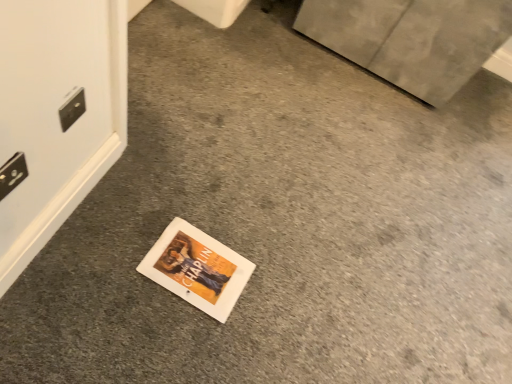
Question: Does white plastic electric outlet at upper left, positioned as the 1th electric outlet in right-to-left order, appear on the right side of black plastic electric outlet at lower left, positioned as the 2th electric outlet in top-to-bottom order?

Choices:
 (A) yes
 (B) no

Answer: (A)

Question: From the image's perspective, is white plastic electric outlet at upper left, marked as the 1th electric outlet in a back-to-front arrangement, over black plastic electric outlet at lower left, the 2th electric outlet when ordered from back to front?

Choices:
 (A) yes
 (B) no

Answer: (A)

Question: Can black plastic electric outlet at lower left, which is the second electric outlet from right to left, be found inside white plastic electric outlet at upper left, acting as the 2th electric outlet starting from the left?

Choices:
 (A) no
 (B) yes

Answer: (A)

Question: From a real-world perspective, is white plastic electric outlet at upper left, the second electric outlet when ordered from front to back, physically below black plastic electric outlet at lower left, the 1th electric outlet in the front-to-back sequence?

Choices:
 (A) yes
 (B) no

Answer: (B)

Question: Is white plastic electric outlet at upper left, which ranks as the second electric outlet in bottom-to-top order, positioned with its back to black plastic electric outlet at lower left, which is the second electric outlet from right to left?

Choices:
 (A) yes
 (B) no

Answer: (B)

Question: Does white plastic electric outlet at upper left, which ranks as the second electric outlet in bottom-to-top order, touch black plastic electric outlet at lower left, the 1th electric outlet in the front-to-back sequence?

Choices:
 (A) no
 (B) yes

Answer: (A)

Question: Does black plastic electric outlet at lower left, which is the second electric outlet from right to left, appear on the right side of white plastic electric outlet at upper left, positioned as the 1th electric outlet in right-to-left order?

Choices:
 (A) no
 (B) yes

Answer: (A)

Question: Is black plastic electric outlet at lower left, which is the 1th electric outlet in left-to-right order, completely or partially outside of white plastic electric outlet at upper left, marked as the 1th electric outlet in a back-to-front arrangement?

Choices:
 (A) no
 (B) yes

Answer: (B)

Question: From a real-world perspective, is black plastic electric outlet at lower left, positioned as the 2th electric outlet in top-to-bottom order, below white plastic electric outlet at upper left, acting as the 2th electric outlet starting from the left?

Choices:
 (A) no
 (B) yes

Answer: (B)

Question: From a real-world perspective, is black plastic electric outlet at lower left, the 1th electric outlet in the front-to-back sequence, positioned over white plastic electric outlet at upper left, acting as the 2th electric outlet starting from the left, based on gravity?

Choices:
 (A) no
 (B) yes

Answer: (A)

Question: Considering the relative sizes of black plastic electric outlet at lower left, arranged as the first electric outlet when ordered from the bottom, and white plastic electric outlet at upper left, positioned as the 1th electric outlet in right-to-left order, in the image provided, is black plastic electric outlet at lower left, arranged as the first electric outlet when ordered from the bottom, smaller than white plastic electric outlet at upper left, positioned as the 1th electric outlet in right-to-left order,?

Choices:
 (A) yes
 (B) no

Answer: (B)

Question: Is black plastic electric outlet at lower left, the 1th electric outlet in the front-to-back sequence, directly adjacent to white plastic electric outlet at upper left, the 1th electric outlet from the top?

Choices:
 (A) no
 (B) yes

Answer: (A)

Question: In terms of width, does white plastic electric outlet at upper left, which ranks as the second electric outlet in bottom-to-top order, look wider or thinner when compared to black plastic electric outlet at lower left, positioned as the 2th electric outlet in top-to-bottom order?

Choices:
 (A) thin
 (B) wide

Answer: (A)